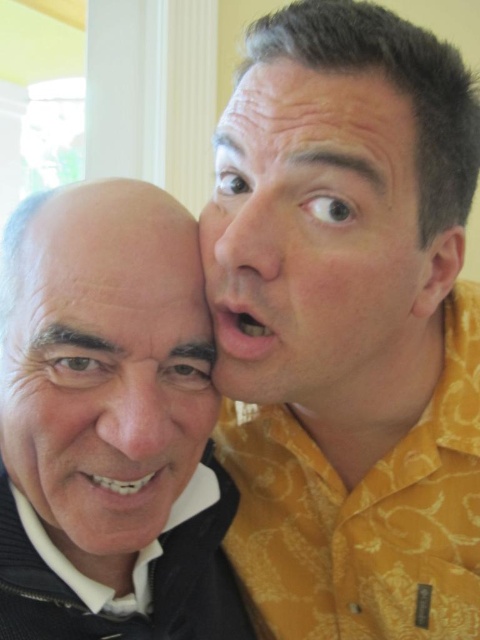
Question: Is matte black face at left to the left of smooth skin face at right from the viewer's perspective?

Choices:
 (A) yes
 (B) no

Answer: (A)

Question: Does yellow patterned shirt at right appear on the left side of smooth skin face at right?

Choices:
 (A) no
 (B) yes

Answer: (A)

Question: Which object is positioned farthest from the yellow patterned shirt at right?

Choices:
 (A) smooth skin face at right
 (B) smooth skin nose at upper center
 (C) matte black face at left
 (D) smooth skin nose at center

Answer: (D)

Question: Which of the following is the closest to the observer?

Choices:
 (A) matte black face at left
 (B) yellow patterned shirt at right
 (C) black knitwear at lower left

Answer: (A)

Question: Which object appears closest to the camera in this image?

Choices:
 (A) dry skin at center
 (B) yellow patterned shirt at right

Answer: (B)

Question: Is black knitwear at lower left below smooth skin nose at upper center?

Choices:
 (A) no
 (B) yes

Answer: (B)